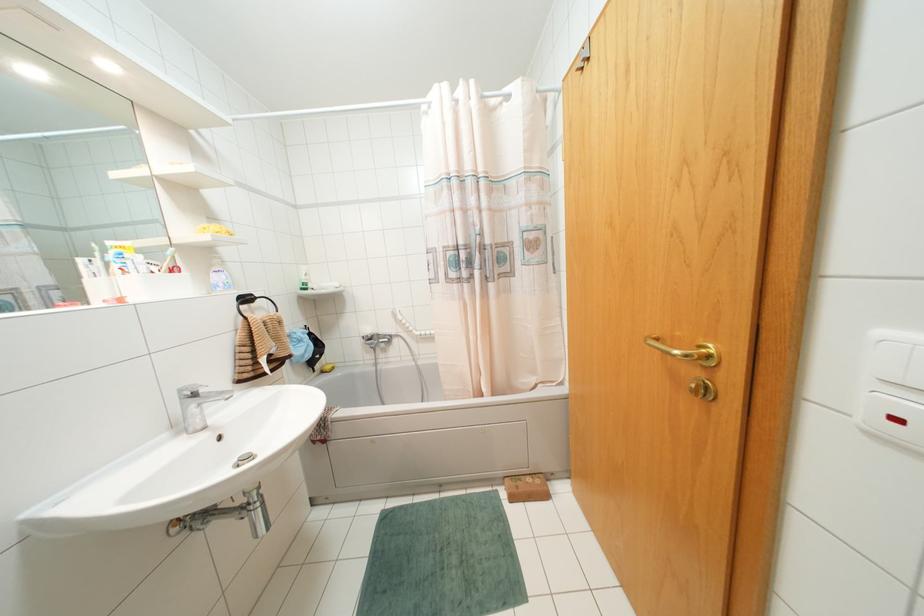
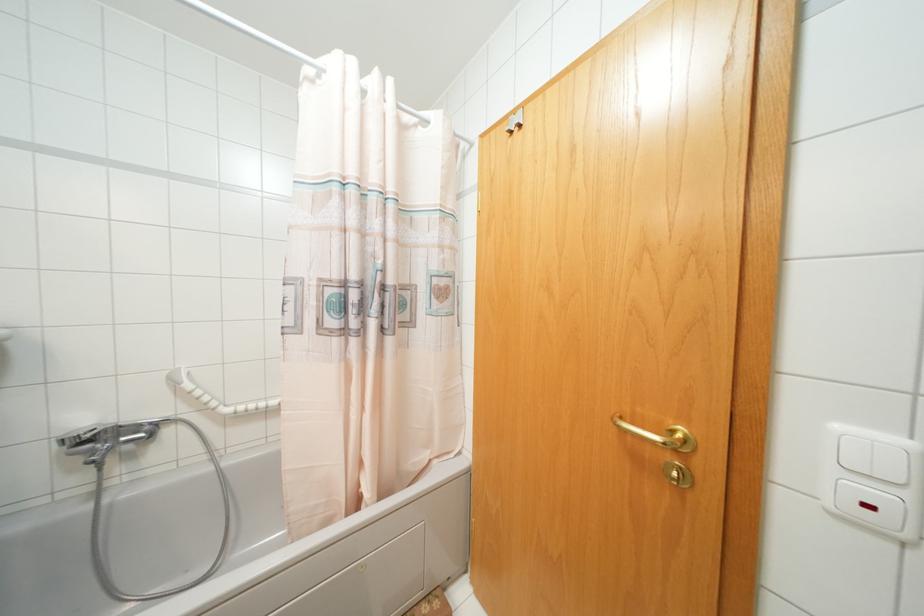
Question: The camera is either moving clockwise (left) or counter-clockwise (right) around the object. The first image is from the beginning of the video and the second image is from the end. Is the camera moving left or right when shooting the video?

Choices:
 (A) Left
 (B) Right

Answer: (A)